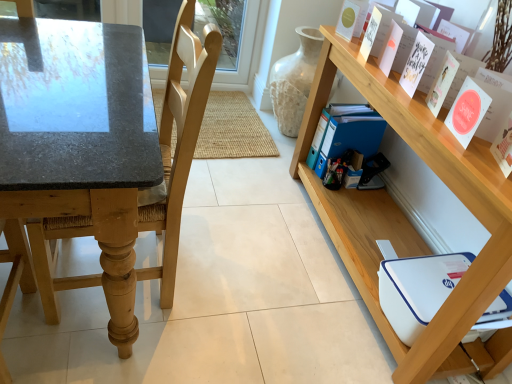
Question: Is light wood chair at left located within blue plastic folder at lower right, which appears as the second paperback book when viewed from the back?

Choices:
 (A) no
 (B) yes

Answer: (A)

Question: From a real-world perspective, is blue plastic folder at lower right, which appears as the second paperback book when viewed from the back, on top of light wood chair at left?

Choices:
 (A) no
 (B) yes

Answer: (A)

Question: Is blue plastic folder at lower right, which is counted as the fifth paperback book, starting from the front, not inside light wood chair at left?

Choices:
 (A) no
 (B) yes

Answer: (B)

Question: From the image's perspective, is blue plastic folder at lower right, which is counted as the fifth paperback book, starting from the front, located beneath light wood chair at left?

Choices:
 (A) yes
 (B) no

Answer: (B)

Question: Is there a large distance between blue plastic folder at lower right, which appears as the second paperback book when viewed from the back, and light wood chair at left?

Choices:
 (A) no
 (B) yes

Answer: (A)

Question: Considering the relative positions of blue plastic folder at lower right, which is counted as the fifth paperback book, starting from the front, and light wood chair at left in the image provided, is blue plastic folder at lower right, which is counted as the fifth paperback book, starting from the front, in front of light wood chair at left?

Choices:
 (A) yes
 (B) no

Answer: (B)

Question: Can you confirm if pink matte paper at upper right, placed as the fourth paperback book when sorted from front to back, is taller than blue plastic folder at lower right, which appears as the second paperback book when viewed from the back?

Choices:
 (A) yes
 (B) no

Answer: (B)

Question: Can you see pink matte paper at upper right, the 3th paperback book viewed from the back, touching blue plastic folder at lower right, which appears as the second paperback book when viewed from the back?

Choices:
 (A) yes
 (B) no

Answer: (B)

Question: Is pink matte paper at upper right, placed as the fourth paperback book when sorted from front to back, looking in the opposite direction of blue plastic folder at lower right, which is counted as the fifth paperback book, starting from the front?

Choices:
 (A) no
 (B) yes

Answer: (A)

Question: Are pink matte paper at upper right, the 3th paperback book viewed from the back, and blue plastic folder at lower right, which appears as the second paperback book when viewed from the back, far apart?

Choices:
 (A) yes
 (B) no

Answer: (B)

Question: Does pink matte paper at upper right, the 3th paperback book viewed from the back, have a lesser width compared to blue plastic folder at lower right, which appears as the second paperback book when viewed from the back?

Choices:
 (A) yes
 (B) no

Answer: (A)

Question: Considering the relative sizes of pink matte paper at upper right, the 3th paperback book viewed from the back, and blue plastic folder at lower right, which is counted as the fifth paperback book, starting from the front, in the image provided, is pink matte paper at upper right, the 3th paperback book viewed from the back, shorter than blue plastic folder at lower right, which is counted as the fifth paperback book, starting from the front,?

Choices:
 (A) no
 (B) yes

Answer: (B)

Question: Is wooden shelf at upper right surrounded by blue plastic folder at center-right, the first paperback book viewed from the back?

Choices:
 (A) no
 (B) yes

Answer: (A)